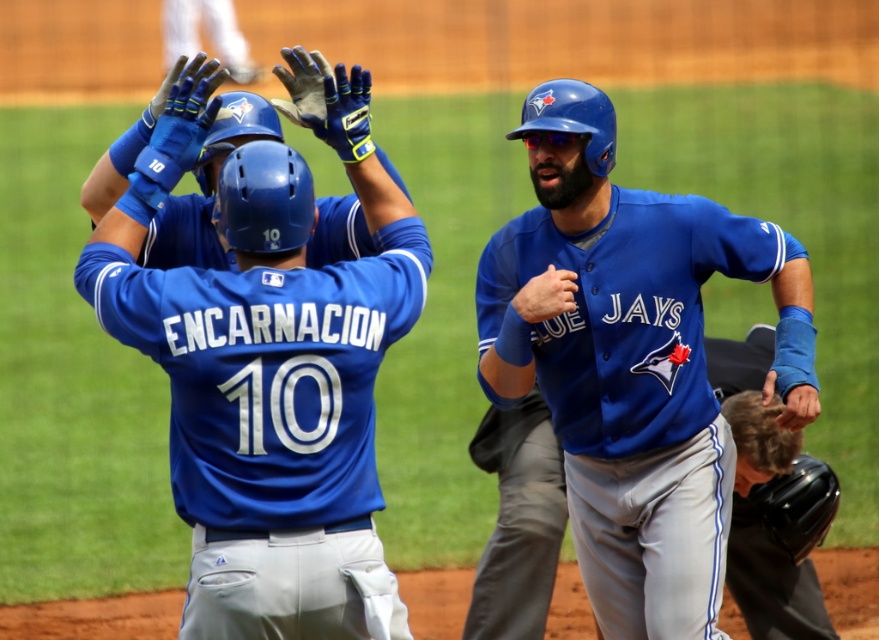
Is point (209, 593) behind point (807, 364)?

That is False.

Is point (309, 451) positioned behind point (572, 236)?

No, (309, 451) is in front of (572, 236).

Where is `matte blue helmet at upper center`? The width and height of the screenshot is (879, 640). matte blue helmet at upper center is located at coordinates (270, 364).